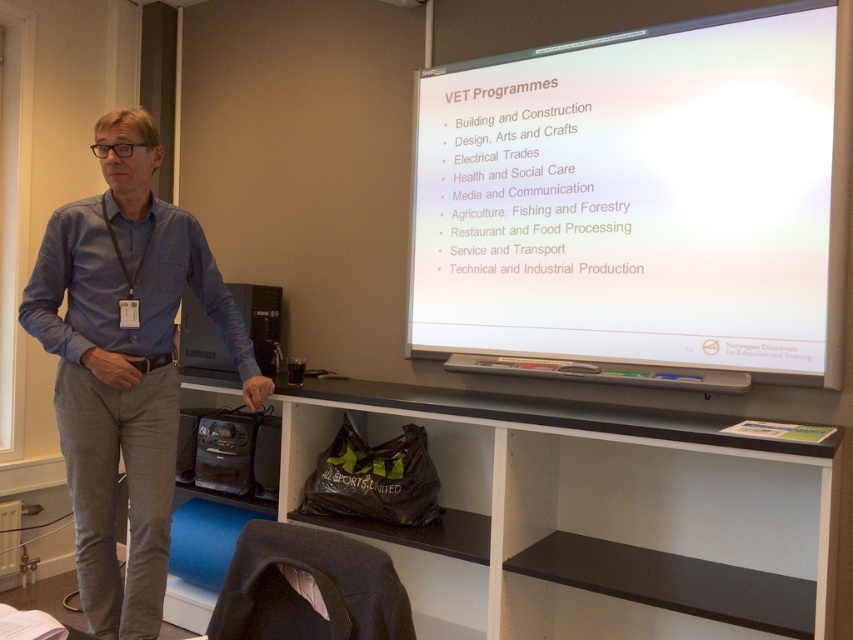
Question: Is white matte projector screen at upper right positioned before blue cotton shirt at left?

Choices:
 (A) yes
 (B) no

Answer: (A)

Question: Is white matte projector screen at upper right positioned in front of blue cotton shirt at left?

Choices:
 (A) no
 (B) yes

Answer: (B)

Question: Which object appears farthest from the camera in this image?

Choices:
 (A) white plastic projector at upper center
 (B) blue cotton shirt at left

Answer: (A)

Question: Estimate the real-world distances between objects in this image. Which object is closer to the blue cotton shirt at left?

Choices:
 (A) white matte projector screen at upper right
 (B) white plastic projector at upper center

Answer: (A)

Question: Among these objects, which one is farthest from the camera?

Choices:
 (A) blue cotton shirt at left
 (B) white plastic projector at upper center
 (C) white matte projector screen at upper right

Answer: (B)

Question: Can you confirm if white matte projector screen at upper right is bigger than blue cotton shirt at left?

Choices:
 (A) yes
 (B) no

Answer: (A)